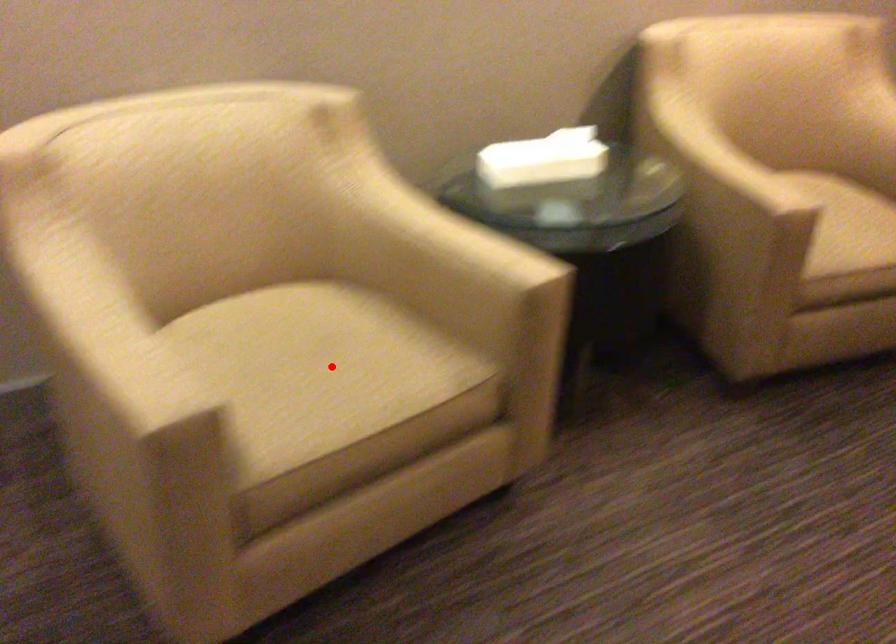
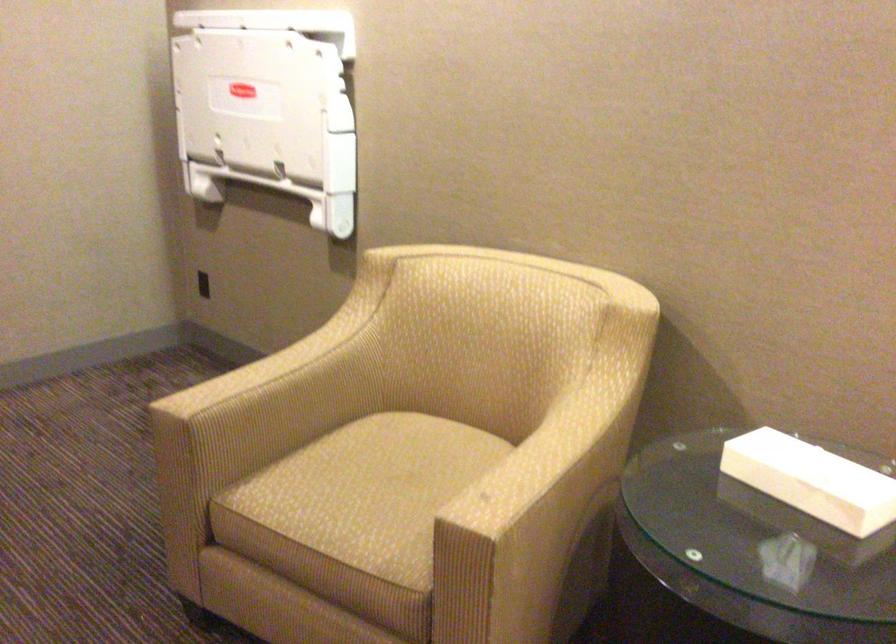
The point at the highlighted location is marked in the first image. Where is the corresponding point in the second image?

(371, 491)